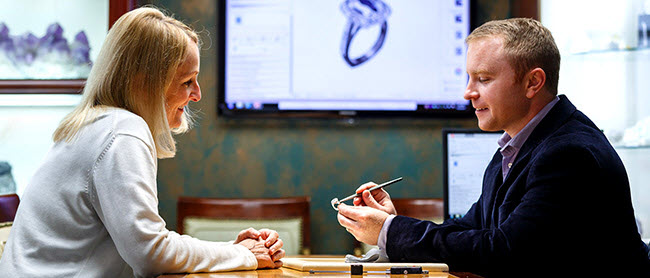
I want to click on wall, so click(x=273, y=166), click(x=202, y=14).